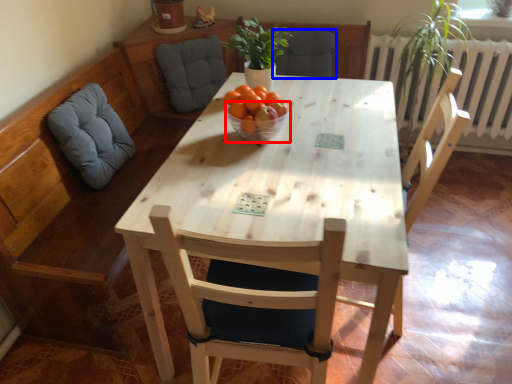
Question: Which object is closer to the camera taking this photo, glass bowl (highlighted by a red box) or armchair (highlighted by a blue box)?

Choices:
 (A) glass bowl
 (B) armchair

Answer: (A)